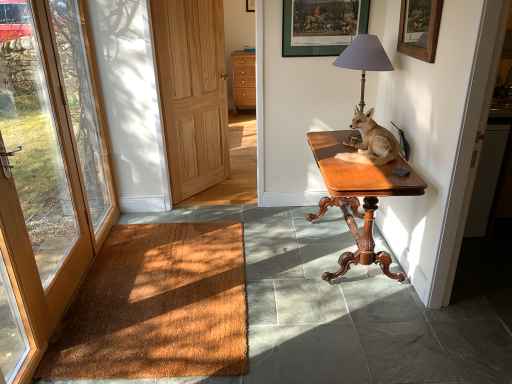
The image size is (512, 384). I want to click on blank space to the left of mahogany wood desk at right, so click(276, 249).